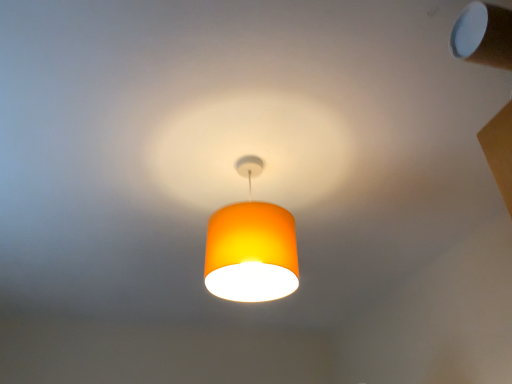
What is the approximate height of orange matte lampshade at center?

orange matte lampshade at center is 16.06 inches in height.

Measure the distance between point (271, 231) and camera.

Point (271, 231) is 3.54 feet from camera.

Find the location of a particular element. orange matte lampshade at center is located at coordinates 251,247.

What do you see at coordinates (251, 247) in the screenshot? The image size is (512, 384). I see `orange matte lampshade at center` at bounding box center [251, 247].

You are a GUI agent. You are given a task and a screenshot of the screen. Output one action in this format:
    pyautogui.click(x=<x>, y=<y>)
    Task: Click on the orange matte lampshade at center
    Image resolution: width=512 pixels, height=384 pixels.
    Given the screenshot: What is the action you would take?
    pyautogui.click(x=251, y=247)